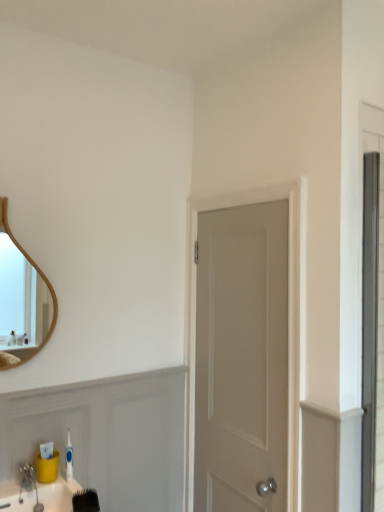
Question: Is wooden mirror at upper left in front of black bristle brush at lower left?

Choices:
 (A) yes
 (B) no

Answer: (B)

Question: Does wooden mirror at upper left have a greater height compared to black bristle brush at lower left?

Choices:
 (A) no
 (B) yes

Answer: (B)

Question: Does wooden mirror at upper left have a greater width compared to black bristle brush at lower left?

Choices:
 (A) yes
 (B) no

Answer: (B)

Question: Is wooden mirror at upper left facing away from black bristle brush at lower left?

Choices:
 (A) no
 (B) yes

Answer: (A)

Question: Is wooden mirror at upper left not within black bristle brush at lower left?

Choices:
 (A) yes
 (B) no

Answer: (A)

Question: Relative to brushed metal faucet at lower left, is black bristle brush at lower left in front or behind?

Choices:
 (A) behind
 (B) front

Answer: (B)

Question: Would you say black bristle brush at lower left is to the left or to the right of brushed metal faucet at lower left in the picture?

Choices:
 (A) left
 (B) right

Answer: (B)

Question: Is point (97, 503) closer or farther from the camera than point (31, 480)?

Choices:
 (A) farther
 (B) closer

Answer: (A)

Question: From a real-world perspective, is black bristle brush at lower left above or below brushed metal faucet at lower left?

Choices:
 (A) below
 (B) above

Answer: (A)

Question: Would you say white matte door at center is inside or outside wooden mirror at upper left?

Choices:
 (A) inside
 (B) outside

Answer: (B)

Question: In terms of size, does white matte door at center appear bigger or smaller than wooden mirror at upper left?

Choices:
 (A) big
 (B) small

Answer: (A)

Question: From a real-world perspective, is white matte door at center positioned above or below wooden mirror at upper left?

Choices:
 (A) above
 (B) below

Answer: (B)

Question: Does point (294, 370) appear closer or farther from the camera than point (43, 292)?

Choices:
 (A) closer
 (B) farther

Answer: (A)

Question: From the image's perspective, is wooden mirror at upper left located above or below brushed metal faucet at lower left?

Choices:
 (A) below
 (B) above

Answer: (B)

Question: Would you say wooden mirror at upper left is inside or outside brushed metal faucet at lower left?

Choices:
 (A) inside
 (B) outside

Answer: (B)